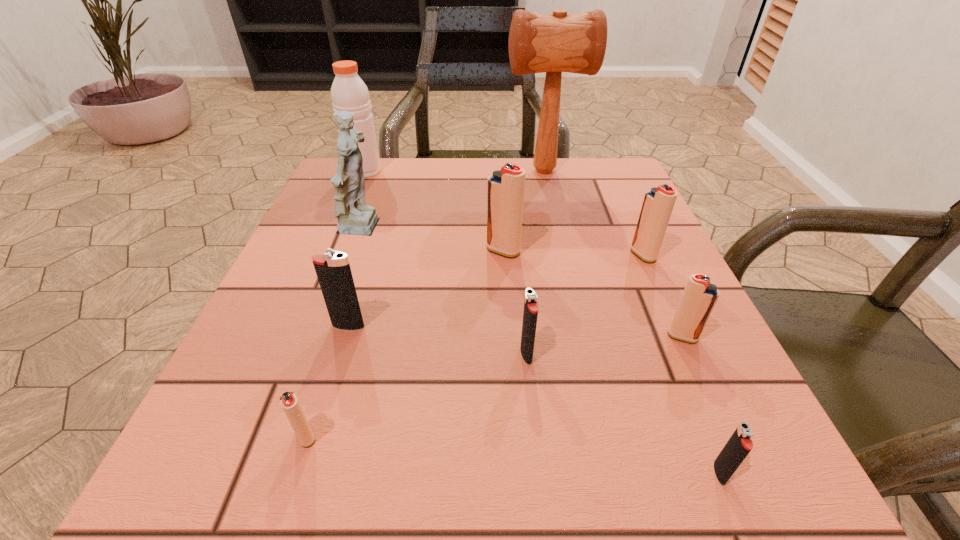
In order to click on vacant space that's between the nearest black igniter and the biggest black igniter in this screenshot , I will do `click(534, 400)`.

Locate which object ranks sixth in proximity to the mallet. Please provide its 2D coordinates. Your answer should be formatted as a tuple, i.e. [(x, y)], where the tuple contains the x and y coordinates of a point satisfying the conditions above.

[(530, 314)]

Find the location of a particular element. Image resolution: width=960 pixels, height=540 pixels. the sixth closest object to the biggest black igniter is located at coordinates (699, 297).

Identify the location of the fourth closest igniter to the orange shaker. This screenshot has height=540, width=960. (658, 203).

Select which igniter appears as the fourth closest to the farthest black igniter. Please provide its 2D coordinates. Your answer should be formatted as a tuple, i.e. [(x, y)], where the tuple contains the x and y coordinates of a point satisfying the conditions above.

[(699, 297)]

Identify which red igniter is the second nearest to the smallest black igniter. Please provide its 2D coordinates. Your answer should be formatted as a tuple, i.e. [(x, y)], where the tuple contains the x and y coordinates of a point satisfying the conditions above.

[(658, 203)]

Identify which red igniter is the nearest to the farthest black igniter. Please provide its 2D coordinates. Your answer should be formatted as a tuple, i.e. [(x, y)], where the tuple contains the x and y coordinates of a point satisfying the conditions above.

[(288, 400)]

I want to click on the second closest black igniter to the ninth farthest object, so click(530, 314).

Identify which black igniter is located as the nearest to the third smallest red igniter. Please provide its 2D coordinates. Your answer should be formatted as a tuple, i.e. [(x, y)], where the tuple contains the x and y coordinates of a point satisfying the conditions above.

[(530, 314)]

The width and height of the screenshot is (960, 540). I want to click on free space that satisfies the following two spatial constraints: 1. on the strike surface of the third smallest red igniter; 2. on the right side of the tallest object, so click(563, 255).